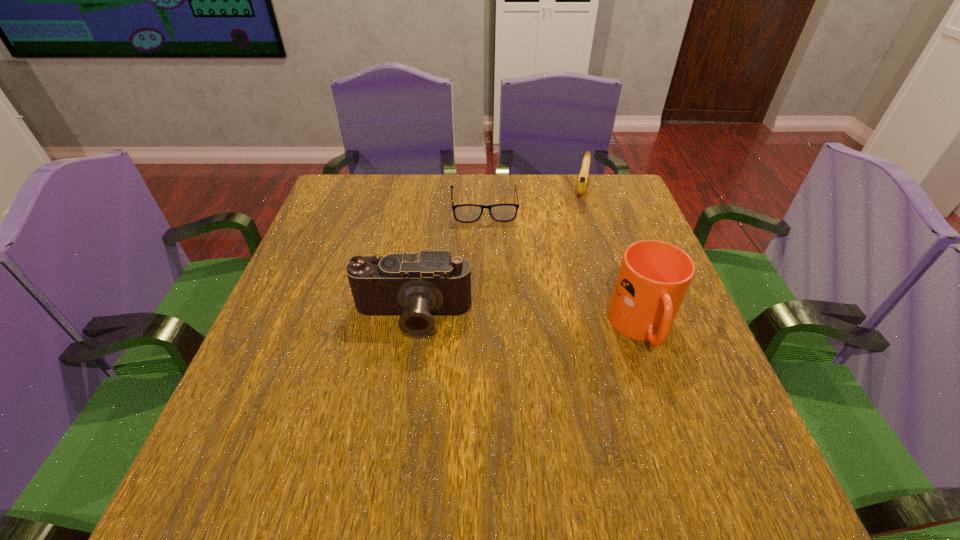
Locate an element on the screen. The image size is (960, 540). vacant space at the right edge of the desktop is located at coordinates (636, 341).

This screenshot has width=960, height=540. I want to click on vacant space at the far left corner of the desktop, so click(x=373, y=191).

I want to click on free space at the near left corner of the desktop, so click(x=229, y=416).

In the image, there is a desktop. Where is `free region at the far right corner`? free region at the far right corner is located at coordinates (624, 178).

Locate an element on the screen. The image size is (960, 540). vacant space at the near right corner is located at coordinates (683, 412).

Locate an element on the screen. This screenshot has width=960, height=540. free space between the banana and the camera is located at coordinates (496, 253).

The image size is (960, 540). What are the coordinates of `free space between the shortest object and the tallest object` in the screenshot? It's located at (564, 267).

You are a GUI agent. You are given a task and a screenshot of the screen. Output one action in this format:
    pyautogui.click(x=<x>, y=<y>)
    Task: Click on the free spot between the tallest object and the third shortest object
    The width and height of the screenshot is (960, 540).
    Given the screenshot: What is the action you would take?
    pyautogui.click(x=527, y=323)

Find the location of a particular element. This screenshot has width=960, height=540. free space between the camera and the banana is located at coordinates (496, 253).

Find the location of `vacant space that is in between the tallest object and the second tallest object`. vacant space that is in between the tallest object and the second tallest object is located at coordinates (527, 323).